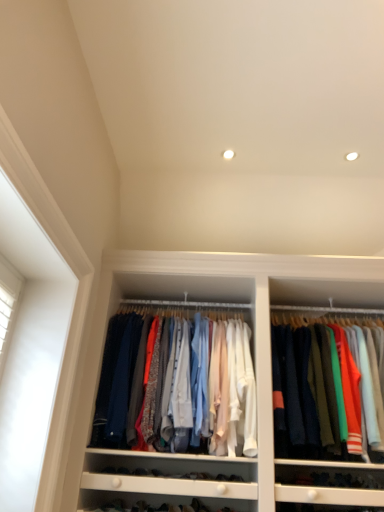
Question: Which direction should I rotate to face matte cotton shirts at center, acting as the first clothing starting from the left, — up or down?

Choices:
 (A) up
 (B) down

Answer: (B)

Question: Does knit sweater at upper right, arranged as the first clothing when viewed from the right, have a lesser height compared to matte cotton shirts at center, the second clothing positioned from the right?

Choices:
 (A) no
 (B) yes

Answer: (A)

Question: From the image's perspective, would you say knit sweater at upper right, the 2th clothing when ordered from left to right, is shown under matte cotton shirts at center, the second clothing positioned from the right?

Choices:
 (A) no
 (B) yes

Answer: (B)

Question: Can you confirm if knit sweater at upper right, arranged as the first clothing when viewed from the right, is smaller than matte cotton shirts at center, acting as the first clothing starting from the left?

Choices:
 (A) yes
 (B) no

Answer: (B)

Question: Is knit sweater at upper right, the 2th clothing when ordered from left to right, not within matte cotton shirts at center, the second clothing positioned from the right?

Choices:
 (A) yes
 (B) no

Answer: (A)

Question: Is knit sweater at upper right, arranged as the first clothing when viewed from the right, to the left of matte cotton shirts at center, the second clothing positioned from the right, from the viewer's perspective?

Choices:
 (A) no
 (B) yes

Answer: (A)

Question: Can you confirm if knit sweater at upper right, the 2th clothing when ordered from left to right, is bigger than matte cotton shirts at center, acting as the first clothing starting from the left?

Choices:
 (A) yes
 (B) no

Answer: (A)

Question: From the image's perspective, is matte cotton shirts at center, acting as the first clothing starting from the left, located beneath knit sweater at upper right, arranged as the first clothing when viewed from the right?

Choices:
 (A) no
 (B) yes

Answer: (A)

Question: From a real-world perspective, is matte cotton shirts at center, the second clothing positioned from the right, below knit sweater at upper right, the 2th clothing when ordered from left to right?

Choices:
 (A) no
 (B) yes

Answer: (A)

Question: Considering the relative sizes of matte cotton shirts at center, acting as the first clothing starting from the left, and knit sweater at upper right, the 2th clothing when ordered from left to right, in the image provided, is matte cotton shirts at center, acting as the first clothing starting from the left, thinner than knit sweater at upper right, the 2th clothing when ordered from left to right,?

Choices:
 (A) no
 (B) yes

Answer: (B)

Question: Considering the relative sizes of matte cotton shirts at center, the second clothing positioned from the right, and knit sweater at upper right, arranged as the first clothing when viewed from the right, in the image provided, is matte cotton shirts at center, the second clothing positioned from the right, smaller than knit sweater at upper right, arranged as the first clothing when viewed from the right,?

Choices:
 (A) no
 (B) yes

Answer: (B)

Question: Does matte cotton shirts at center, the second clothing positioned from the right, touch knit sweater at upper right, the 2th clothing when ordered from left to right?

Choices:
 (A) no
 (B) yes

Answer: (A)

Question: Is matte cotton shirts at center, acting as the first clothing starting from the left, facing away from knit sweater at upper right, arranged as the first clothing when viewed from the right?

Choices:
 (A) yes
 (B) no

Answer: (B)

Question: Is matte cotton shirts at center, acting as the first clothing starting from the left, spatially inside knit sweater at upper right, the 2th clothing when ordered from left to right, or outside of it?

Choices:
 (A) outside
 (B) inside

Answer: (A)